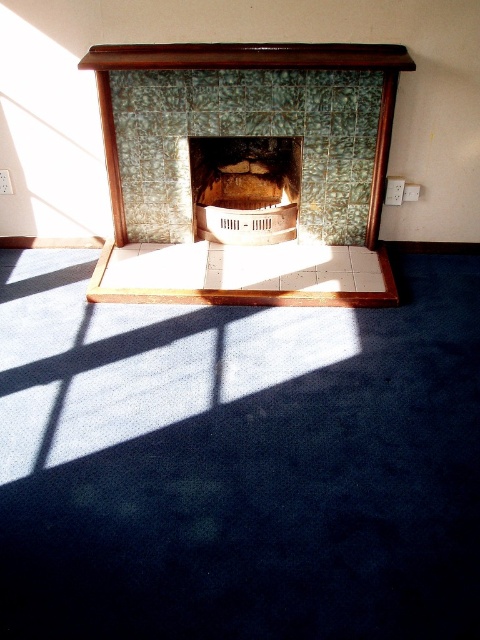
You are standing in the room and want to place a small decorative item exactly at the point marked as point (250, 150). According to the scene description, where will this point be located?

The point (250, 150) is on the green textured tile fireplace at center, so placing the decorative item there would position it on the fireplace tiles.

You are standing in a room with a fireplace. You see a green textured tile fireplace at center and a matte stone fireplace at center. Which one is positioned to the left?

The green textured tile fireplace at center is positioned to the left of the matte stone fireplace at center.

You are standing in the room with the vintage fireplace. You notice two points marked in the image. The first point is at coordinates point [162,272] and the second is at point [292,150]. Which point is closer to you from your current position?

Point [162,272] is in front of point [292,150], so it is closer to you.